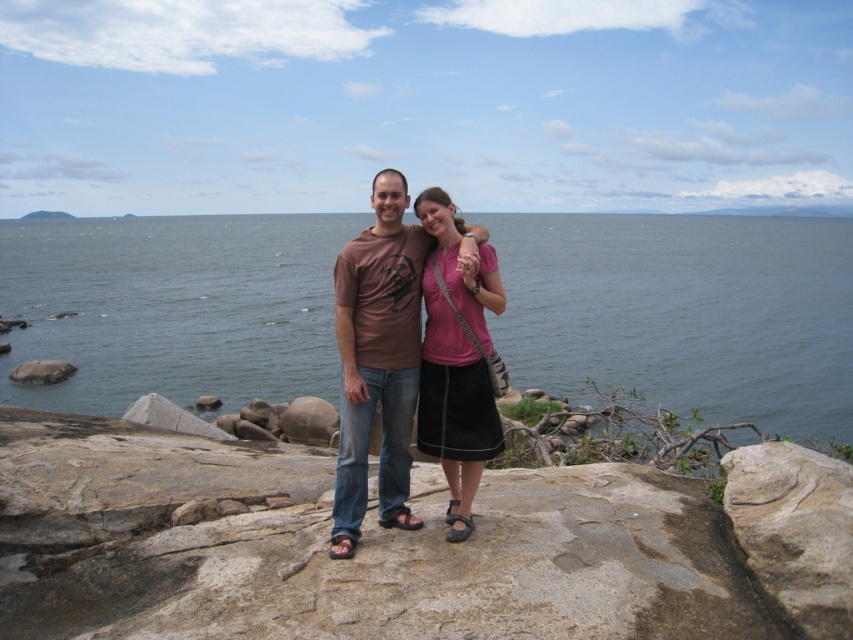
Question: Is gray rough rock at center thinner than gray rock at lower left?

Choices:
 (A) no
 (B) yes

Answer: (B)

Question: Which point is closer to the camera?

Choices:
 (A) (792, 570)
 (B) (799, 476)

Answer: (A)

Question: Considering the real-world distances, which object is farthest from the gray rock at lower left?

Choices:
 (A) brown rock at center
 (B) gray rough rock at center

Answer: (B)

Question: From the image, what is the correct spatial relationship of brown rock at center in relation to gray rock at lower left?

Choices:
 (A) below
 (B) above

Answer: (B)

Question: Among these objects, which one is farthest from the camera?

Choices:
 (A) brown rock at center
 (B) brown cotton t-shirt at center
 (C) gray rock at lower left
 (D) gray rough rock at center

Answer: (C)

Question: Does pink fabric skirt at center come in front of gray rock at lower left?

Choices:
 (A) no
 (B) yes

Answer: (B)